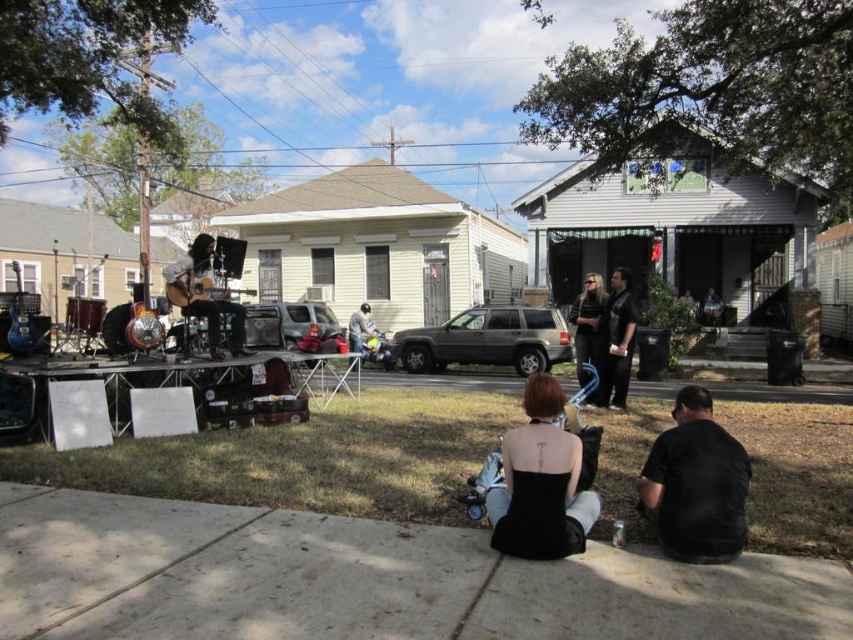
How much distance is there between black matte dress at lower center and black smooth shirt at center?

black matte dress at lower center and black smooth shirt at center are 4.71 meters apart from each other.

Which is behind, point (519, 429) or point (607, 348)?

Point (607, 348)

This screenshot has height=640, width=853. I want to click on black matte dress at lower center, so click(543, 481).

Is black matte shirt at lower right thinner than black smooth shirt at center?

Incorrect, black matte shirt at lower right's width is not less than black smooth shirt at center's.

Between point (657, 440) and point (618, 342), which one is positioned behind?

The point (618, 342) is more distant.

Where is `black matte shirt at lower right`? The width and height of the screenshot is (853, 640). black matte shirt at lower right is located at coordinates (695, 484).

What do you see at coordinates (695, 484) in the screenshot? This screenshot has width=853, height=640. I see `black matte shirt at lower right` at bounding box center [695, 484].

Can you confirm if black matte shirt at lower right is positioned above black leather jacket at center?

No.

Is point (708, 525) positioned in front of point (596, 289)?

Yes, point (708, 525) is closer to viewer.

Where is `black matte shirt at lower right`? Image resolution: width=853 pixels, height=640 pixels. black matte shirt at lower right is located at coordinates (695, 484).